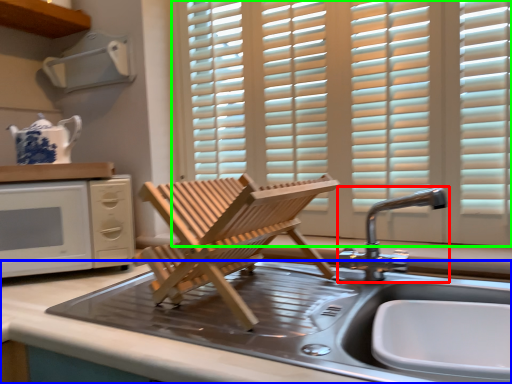
Question: Based on their relative distances, which object is farther from tap (highlighted by a red box)? Choose from countertop (highlighted by a blue box) and window (highlighted by a green box).

Choices:
 (A) countertop
 (B) window

Answer: (B)